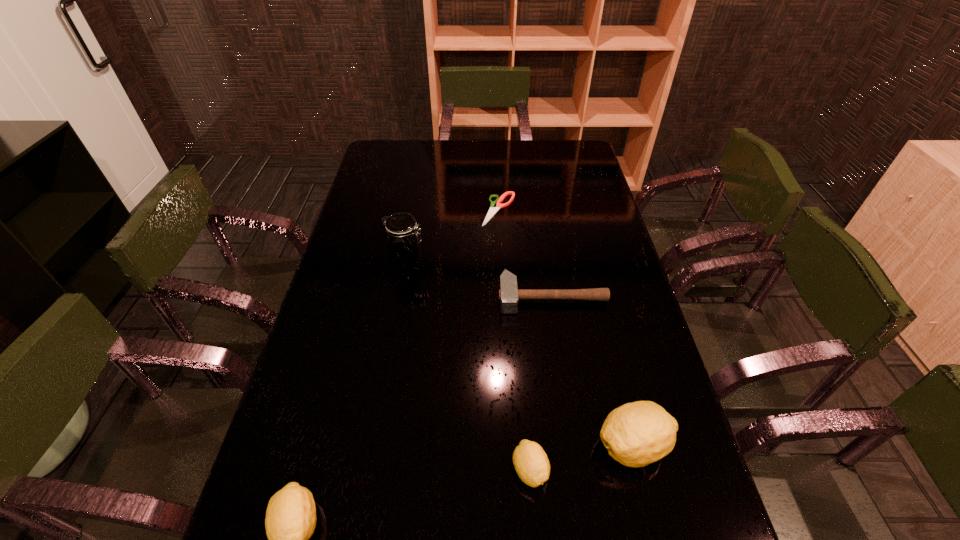
The width and height of the screenshot is (960, 540). Identify the location of the shortest lemon. pyautogui.click(x=531, y=463).

Where is `the second lemon from right to left`? the second lemon from right to left is located at coordinates (531, 463).

This screenshot has height=540, width=960. Find the location of `the tallest lemon`. the tallest lemon is located at coordinates (636, 434).

Locate an element on the screen. The image size is (960, 540). the fifth shortest object is located at coordinates (636, 434).

I want to click on the shortest object, so click(493, 210).

Find the location of a particular element. the farthest object is located at coordinates (493, 210).

Where is `jar`? The height and width of the screenshot is (540, 960). jar is located at coordinates (404, 238).

The image size is (960, 540). I want to click on the tallest object, so click(x=404, y=238).

Find the location of a particular element. hammer is located at coordinates (509, 294).

Where is `the second shortest object`? The image size is (960, 540). the second shortest object is located at coordinates (509, 294).